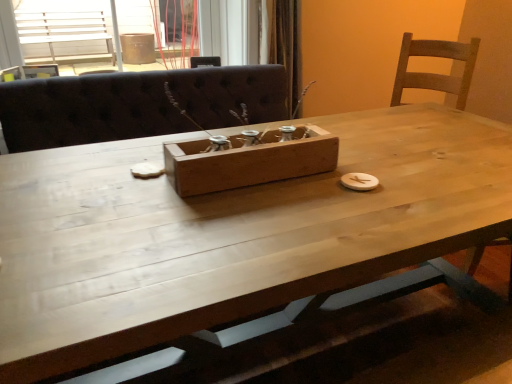
Find the location of a particular element. This screenshot has height=384, width=512. blank space to the left of wooden box at center is located at coordinates (119, 183).